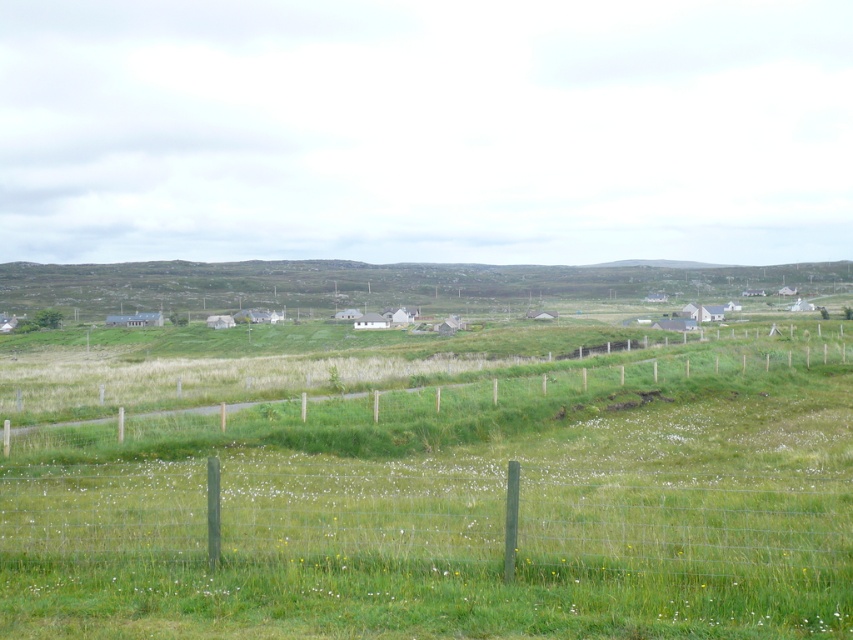
You are standing in the rural landscape and want to cross from the grassy field to the road. The green wire fence at lower center and the green wooden fence at center are in your path. Which fence do you need to climb over to reach the road?

You need to climb over the green wooden fence at center because it is taller than the green wire fence at lower center, so the wooden fence is the one blocking your path to the road.

You are standing at the fence in the foreground of the rural landscape. You notice two points marked on the image, one at coordinates point (727,540) and the other at point (556,419). Which point is closer to you?

Point (727,540) is closer to the viewer than point (556,419).